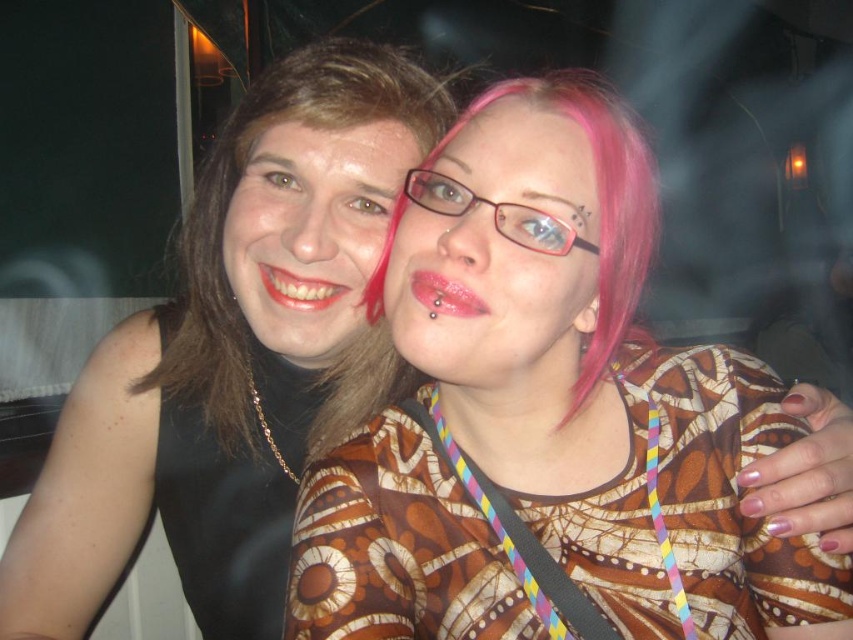
You are a photographer setting up a shot. You have a matte black dress at center and a shiny pink lipstick at center in the frame. Which object should you adjust to ensure both fit within the camera frame if the dress is wider?

Since the matte black dress at center might be wider than the shiny pink lipstick at center, you should adjust the angle or zoom to accommodate the width of the matte black dress at center to ensure both fit in the frame.